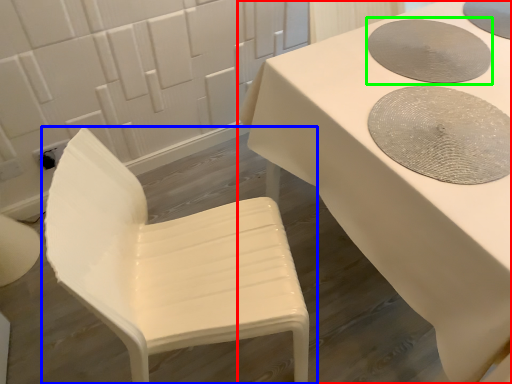
Question: Which object is the closest to the table (highlighted by a red box)? Choose among these: chair (highlighted by a blue box) or manhole cover (highlighted by a green box).

Choices:
 (A) chair
 (B) manhole cover

Answer: (B)